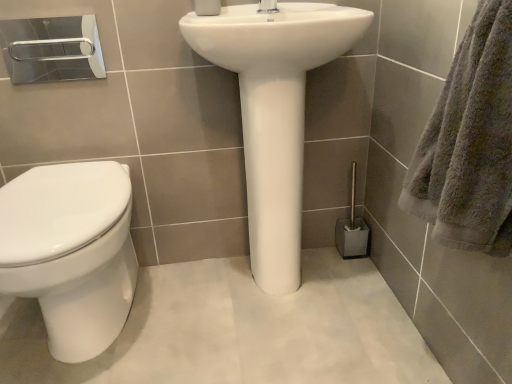
Question: From the image's perspective, is metallic silver toilet brush at lower right beneath white matte toilet paper at upper center?

Choices:
 (A) no
 (B) yes

Answer: (B)

Question: Considering the relative sizes of metallic silver toilet brush at lower right and white matte toilet paper at upper center in the image provided, is metallic silver toilet brush at lower right smaller than white matte toilet paper at upper center?

Choices:
 (A) yes
 (B) no

Answer: (B)

Question: Is metallic silver toilet brush at lower right in contact with white matte toilet paper at upper center?

Choices:
 (A) no
 (B) yes

Answer: (A)

Question: Is metallic silver toilet brush at lower right oriented away from white matte toilet paper at upper center?

Choices:
 (A) yes
 (B) no

Answer: (B)

Question: Does metallic silver toilet brush at lower right come in front of white matte toilet paper at upper center?

Choices:
 (A) yes
 (B) no

Answer: (B)

Question: Visually, is white glossy tap at upper center positioned to the left or to the right of silver metallic towel bar at upper left?

Choices:
 (A) right
 (B) left

Answer: (A)

Question: Is white glossy tap at upper center in front of or behind silver metallic towel bar at upper left in the image?

Choices:
 (A) front
 (B) behind

Answer: (A)

Question: Does point (273, 8) appear closer or farther from the camera than point (25, 26)?

Choices:
 (A) farther
 (B) closer

Answer: (B)

Question: In terms of size, does white glossy tap at upper center appear bigger or smaller than silver metallic towel bar at upper left?

Choices:
 (A) big
 (B) small

Answer: (A)

Question: From a real-world perspective, relative to gray fluffy towel at right, is white glossy tap at upper center vertically above or below?

Choices:
 (A) below
 (B) above

Answer: (B)

Question: From the image's perspective, relative to gray fluffy towel at right, is white glossy tap at upper center above or below?

Choices:
 (A) below
 (B) above

Answer: (B)

Question: Considering their positions, is white glossy tap at upper center located in front of or behind gray fluffy towel at right?

Choices:
 (A) front
 (B) behind

Answer: (B)

Question: Choose the correct answer: Is white glossy tap at upper center inside gray fluffy towel at right or outside it?

Choices:
 (A) outside
 (B) inside

Answer: (A)

Question: Is white glossy toilet at left bigger or smaller than silver metallic towel bar at upper left?

Choices:
 (A) big
 (B) small

Answer: (A)

Question: Looking at their shapes, would you say white glossy toilet at left is wider or thinner than silver metallic towel bar at upper left?

Choices:
 (A) thin
 (B) wide

Answer: (B)